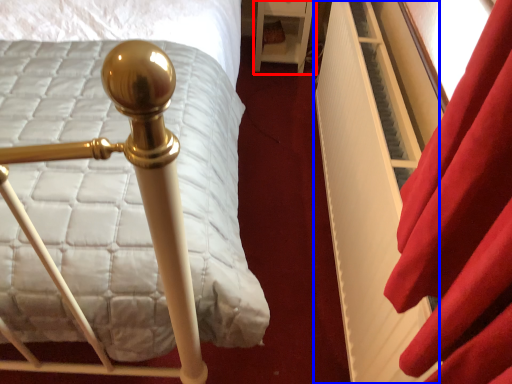
Question: Among these objects, which one is nearest to the camera, furniture (highlighted by a red box) or bed frame (highlighted by a blue box)?

Choices:
 (A) furniture
 (B) bed frame

Answer: (B)